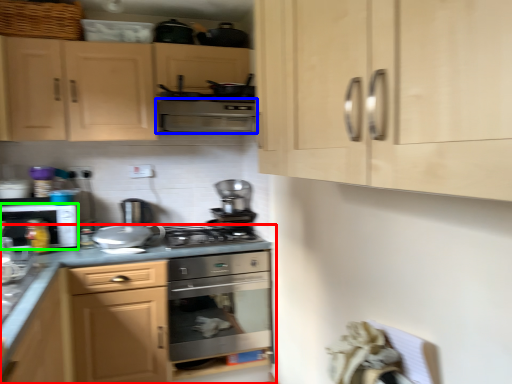
Question: Considering the real-world distances, which object is farthest from cabinetry (highlighted by a red box)? vent (highlighted by a blue box) or kitchen appliance (highlighted by a green box)?

Choices:
 (A) vent
 (B) kitchen appliance

Answer: (A)